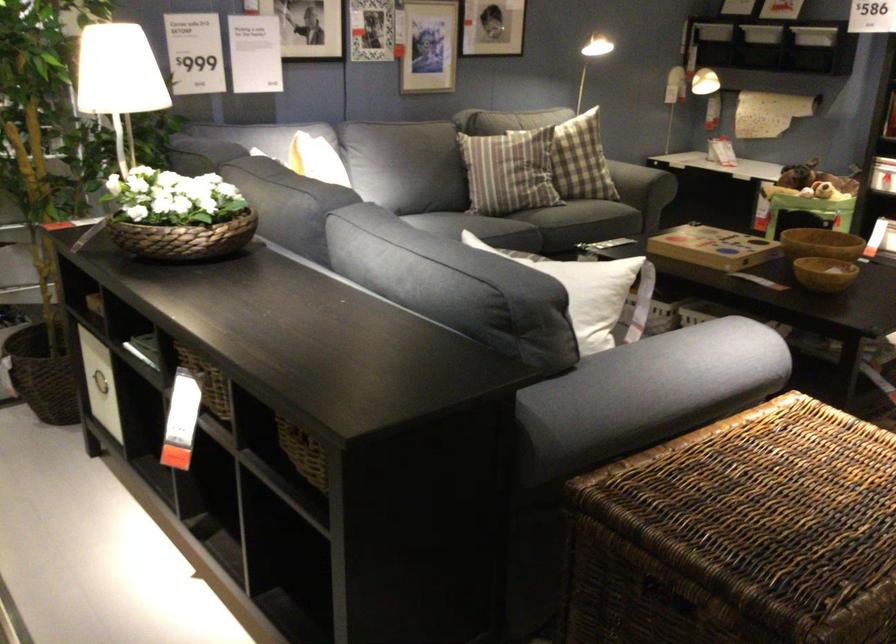
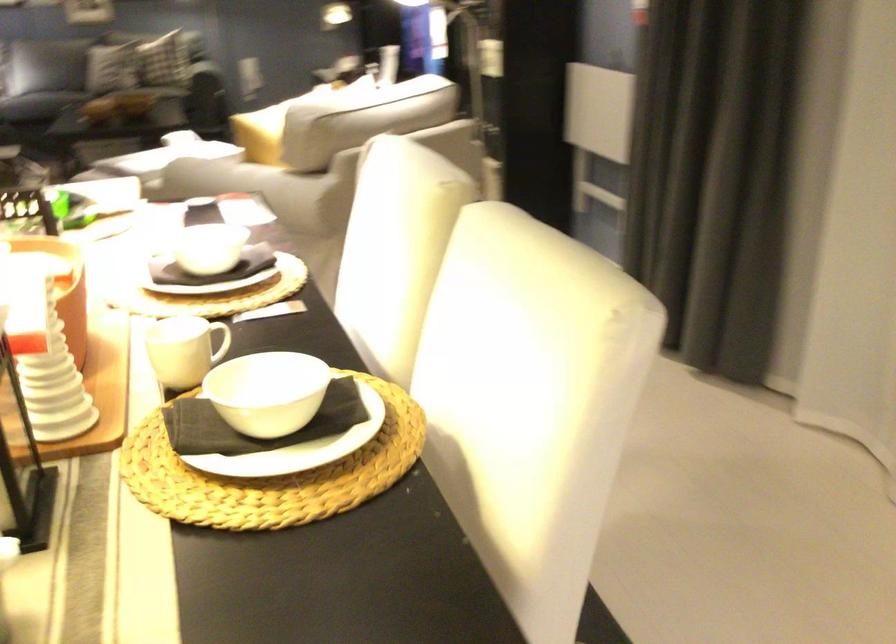
Question: I am providing you with two images of the same scene from different viewpoints. Please identify which objects are invisible in image2.

Choices:
 (A) green cylindrical can
 (B) wooden bowl
 (C) sofa armrest
 (D) dark napkin

Answer: (B)